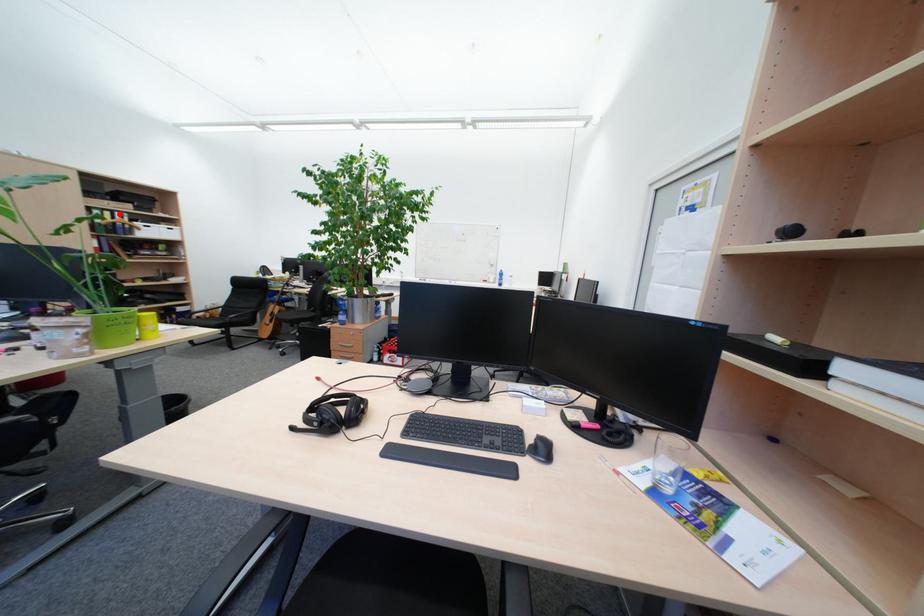
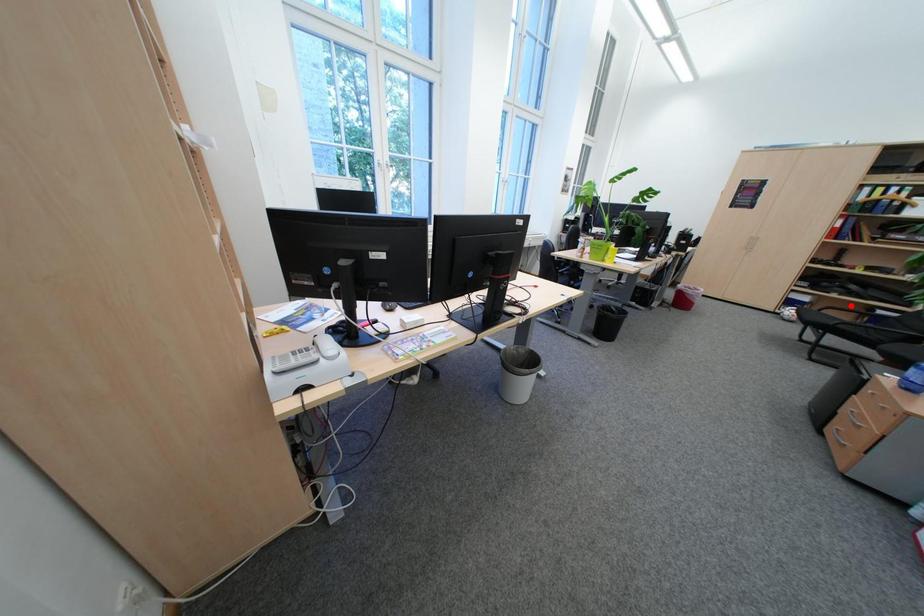
I am providing you with two images of the same scene from different viewpoints. A red point is marked on the first image and another point is marked on the second image. Do the highlighted points in image1 and image2 indicate the same real-world spot?

No